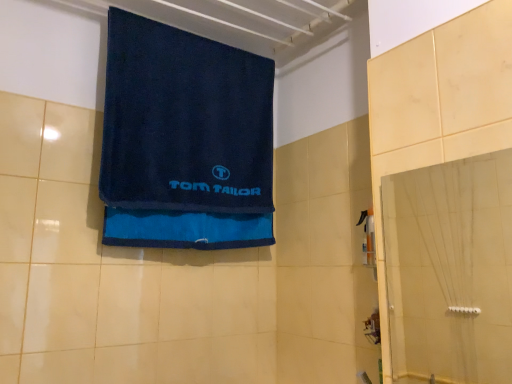
Question: From a real-world perspective, is transparent glass door at right physically below navy blue terry cloth towel at upper center?

Choices:
 (A) yes
 (B) no

Answer: (A)

Question: Is transparent glass door at right in contact with navy blue terry cloth towel at upper center?

Choices:
 (A) yes
 (B) no

Answer: (B)

Question: Does transparent glass door at right have a larger size compared to navy blue terry cloth towel at upper center?

Choices:
 (A) yes
 (B) no

Answer: (B)

Question: Could you tell me if transparent glass door at right is turned towards navy blue terry cloth towel at upper center?

Choices:
 (A) no
 (B) yes

Answer: (A)

Question: Is transparent glass door at right shorter than navy blue terry cloth towel at upper center?

Choices:
 (A) no
 (B) yes

Answer: (B)

Question: From the image's perspective, is transparent glass door at right over navy blue terry cloth towel at upper center?

Choices:
 (A) no
 (B) yes

Answer: (A)

Question: Is transparent glass door at right inside navy blue terry cloth towel at upper center?

Choices:
 (A) yes
 (B) no

Answer: (B)

Question: From a real-world perspective, is navy blue terry cloth towel at upper center over transparent glass door at right?

Choices:
 (A) yes
 (B) no

Answer: (A)

Question: Is navy blue terry cloth towel at upper center bigger than transparent glass door at right?

Choices:
 (A) yes
 (B) no

Answer: (A)

Question: Is navy blue terry cloth towel at upper center not close to transparent glass door at right?

Choices:
 (A) no
 (B) yes

Answer: (B)

Question: Does navy blue terry cloth towel at upper center have a greater height compared to transparent glass door at right?

Choices:
 (A) no
 (B) yes

Answer: (B)

Question: From the image's perspective, is navy blue terry cloth towel at upper center above transparent glass door at right?

Choices:
 (A) yes
 (B) no

Answer: (A)

Question: Is navy blue terry cloth towel at upper center bigger or smaller than transparent glass door at right?

Choices:
 (A) big
 (B) small

Answer: (A)